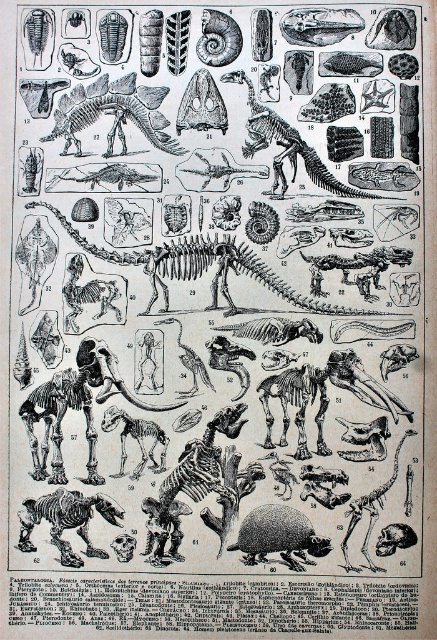
Does bone-like dinosaur skeleton at upper center appear under brown bone-like dinosaur skeleton at lower left?

No, bone-like dinosaur skeleton at upper center is not below brown bone-like dinosaur skeleton at lower left.

Is point (110, 148) behind point (69, 518)?

Yes, it is.

Locate an element on the screen. This screenshot has height=640, width=437. bone-like dinosaur skeleton at upper center is located at coordinates (114, 113).

Is smooth gray skull at center taller than brown textured armadillo at center?

Correct, smooth gray skull at center is much taller as brown textured armadillo at center.

Where is `smooth gray skull at center`? The height and width of the screenshot is (640, 437). smooth gray skull at center is located at coordinates (322, 396).

Between point (301, 454) and point (278, 540), which one is positioned in front?

Point (278, 540) is more forward.

Image resolution: width=437 pixels, height=640 pixels. What are the coordinates of `smooth gray skull at center` in the screenshot? It's located at (322, 396).

Who is shorter, brown textured armadillo at center or smooth bone dinosaur at center?

Standing shorter between the two is brown textured armadillo at center.

Measure the distance between point (262,529) and camera.

Point (262,529) is 4.94 feet from camera.

This screenshot has height=640, width=437. What are the coordinates of `brown textured armadillo at center` in the screenshot? It's located at (278, 536).